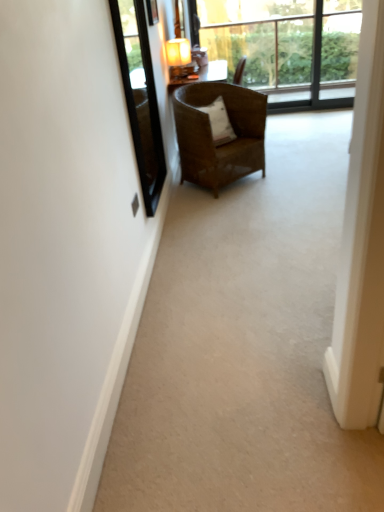
At what (x,y) coordinates should I click in order to perform the action: click on unoccupied region to the right of brown woven chair at center. Please return your answer as a coordinate pair (x, y). The image size is (384, 512). Looking at the image, I should click on (304, 174).